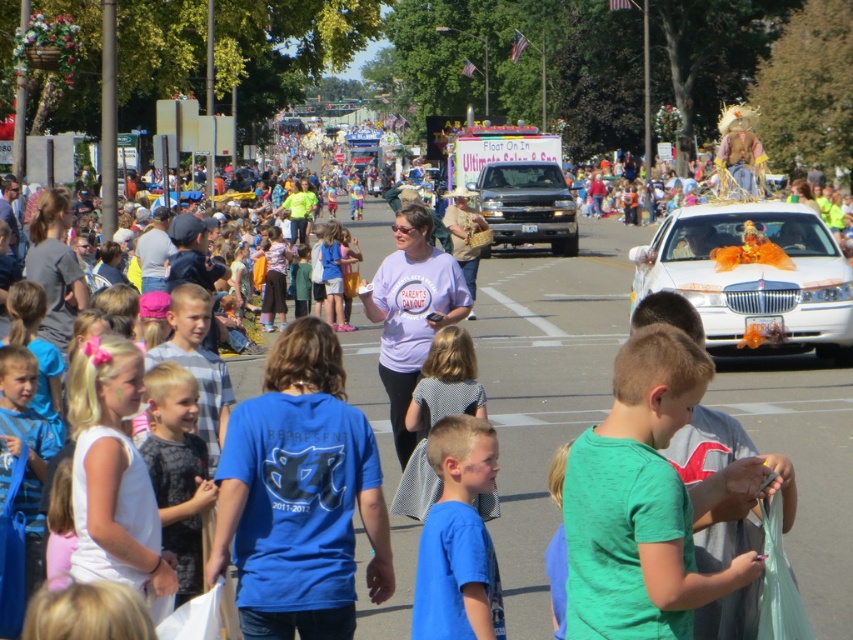
You are a photographer trying to capture both the blue cotton shirt at center and the dark gray printed shirt at center in the same frame. Which shirt should you focus on to ensure both are visible without moving the camera?

The blue cotton shirt at center has a lesser width compared to dark gray printed shirt at center, so focusing on the blue cotton shirt at center would allow the wider dark gray printed shirt at center to still fit within the frame without needing to adjust the camera position.

From the picture: You are standing at the starting point of the parade route and want to reach the first checkpoint. The first checkpoint is located at either point (422,582) or point (416,429). Based on the image, which point is closer to you?

Point (422,582) is closer to the viewer than point (416,429), so the first checkpoint is at point (422,582).